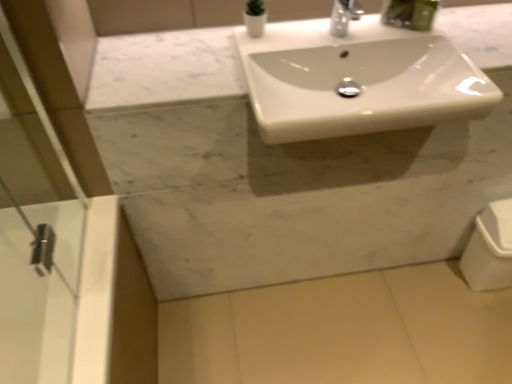
The width and height of the screenshot is (512, 384). I want to click on vacant area in front of white glossy vase at upper center, so click(256, 50).